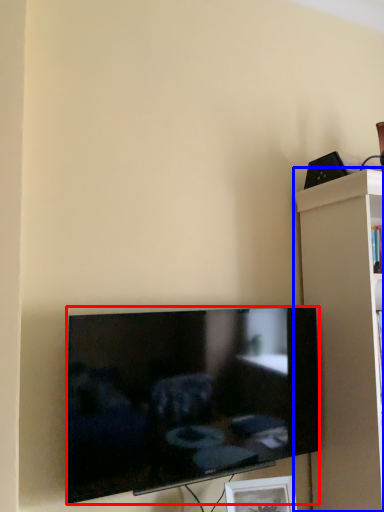
Question: Which point is closer to the camera, television (highlighted by a red box) or shelf (highlighted by a blue box)?

Choices:
 (A) television
 (B) shelf

Answer: (A)